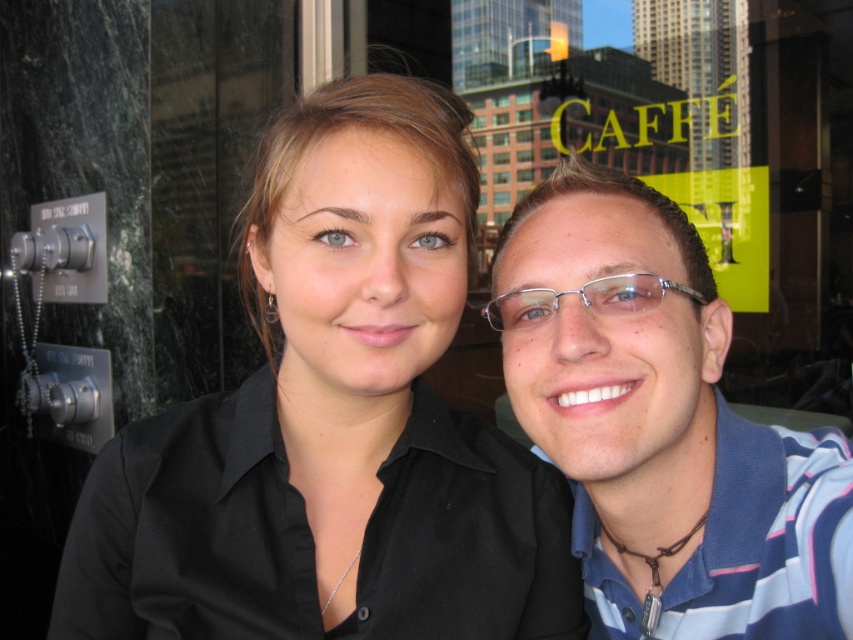
Does black matte shirt at center have a smaller size compared to blue striped polo shirt at right?

Incorrect, black matte shirt at center is not smaller in size than blue striped polo shirt at right.

Is black matte shirt at center above blue striped polo shirt at right?

Yes, black matte shirt at center is above blue striped polo shirt at right.

Between point (459, 145) and point (711, 612), which one is positioned in front?

Point (459, 145) is more forward.

You are a GUI agent. You are given a task and a screenshot of the screen. Output one action in this format:
    pyautogui.click(x=<x>, y=<y>)
    Task: Click on the black matte shirt at center
    This screenshot has height=640, width=853.
    Given the screenshot: What is the action you would take?
    pyautogui.click(x=332, y=422)

Is black matte shirt at center above metallic frame glasses at center?

No.

Describe the element at coordinates (332, 422) in the screenshot. I see `black matte shirt at center` at that location.

Where is `black matte shirt at center`? The height and width of the screenshot is (640, 853). black matte shirt at center is located at coordinates (332, 422).

Between blue striped polo shirt at right and metallic frame glasses at center, which one is positioned higher?

metallic frame glasses at center is higher up.

Between point (625, 408) and point (526, 300), which one is positioned behind?

Point (526, 300)

Between point (704, 525) and point (625, 284), which one is positioned behind?

The point (704, 525) is behind.

This screenshot has height=640, width=853. I want to click on blue striped polo shirt at right, so click(x=660, y=426).